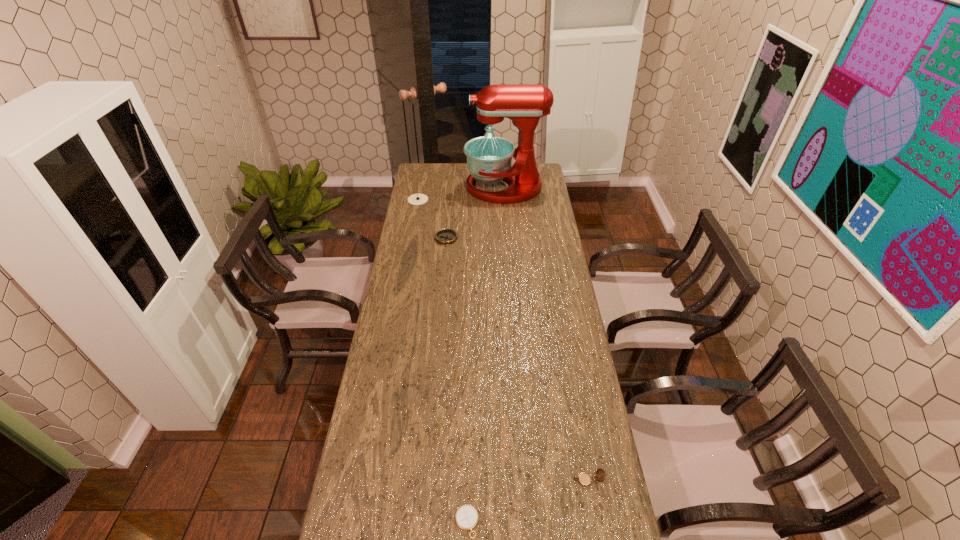
Locate an element on the screen. The height and width of the screenshot is (540, 960). free point between the second nearest compass and the third compass from left to right is located at coordinates (527, 501).

Where is `free space that is in between the third tallest object and the third nearest compass`? The height and width of the screenshot is (540, 960). free space that is in between the third tallest object and the third nearest compass is located at coordinates (516, 359).

Locate an element on the screen. This screenshot has width=960, height=540. vacant space in between the nearest object and the farthest compass is located at coordinates (443, 361).

Identify the location of vacant area that lies between the tallest object and the second object from left to right. (475, 213).

Where is `vacant space that's between the nearest object and the tallest object`? vacant space that's between the nearest object and the tallest object is located at coordinates (486, 355).

Find the location of a particular element. Image resolution: width=960 pixels, height=540 pixels. free spot between the nearest object and the third tallest compass is located at coordinates (457, 380).

This screenshot has height=540, width=960. Identify the location of object that is the nearest to the third nearest object. (416, 199).

The image size is (960, 540). Identify the location of object identified as the fourth closest to the second farthest compass. (466, 517).

Find the location of `compass object that ranks as the fourth closest to the mixer`. compass object that ranks as the fourth closest to the mixer is located at coordinates (466, 517).

You are a GUI agent. You are given a task and a screenshot of the screen. Output one action in this format:
    pyautogui.click(x=<x>, y=<y>)
    Task: Click on the second closest compass to the leftmost compass
    
    Given the screenshot: What is the action you would take?
    pyautogui.click(x=584, y=479)